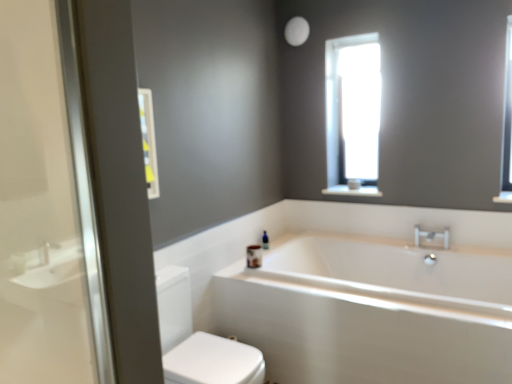
What do you see at coordinates (431, 238) in the screenshot? This screenshot has height=384, width=512. I see `silver metallic faucet at upper right` at bounding box center [431, 238].

The image size is (512, 384). What do you see at coordinates (265, 240) in the screenshot? I see `blue glass bottle at upper center` at bounding box center [265, 240].

Identify the location of white glossy toilet at lower left. The image size is (512, 384). (198, 340).

The height and width of the screenshot is (384, 512). I want to click on silver metallic faucet at upper right, so click(431, 238).

From the image's perspective, between blue glass bottle at upper center and white glossy toilet at lower left, which one is located above?

blue glass bottle at upper center.

Between blue glass bottle at upper center and white glossy toilet at lower left, which one is positioned behind?

blue glass bottle at upper center is more distant.

Which is closer, (263, 243) or (194, 345)?

Clearly, point (263, 243) is more distant from the camera than point (194, 345).

Considering the sizes of objects blue glass bottle at upper center and silver metallic faucet at upper right in the image provided, who is thinner, blue glass bottle at upper center or silver metallic faucet at upper right?

silver metallic faucet at upper right is thinner.

Considering the sizes of objects blue glass bottle at upper center and silver metallic faucet at upper right in the image provided, who is taller, blue glass bottle at upper center or silver metallic faucet at upper right?

With more height is blue glass bottle at upper center.

Considering the relative positions of blue glass bottle at upper center and silver metallic faucet at upper right in the image provided, is blue glass bottle at upper center in front of silver metallic faucet at upper right?

That is False.

From a real-world perspective, between blue glass bottle at upper center and white glossy medicine cabinet at upper left, who is vertically higher?

white glossy medicine cabinet at upper left is physically above.

From the image's perspective, is blue glass bottle at upper center above white glossy medicine cabinet at upper left?

Incorrect, from the image's perspective, blue glass bottle at upper center is lower than white glossy medicine cabinet at upper left.

Considering the positions of point (262, 238) and point (154, 183), is point (262, 238) closer or farther from the camera than point (154, 183)?

Point (262, 238) is farther from the camera than point (154, 183).

Between blue glass bottle at upper center and white glossy medicine cabinet at upper left, which one has more height?

white glossy medicine cabinet at upper left.

This screenshot has width=512, height=384. I want to click on bathtub lying below the white glossy medicine cabinet at upper left (from the image's perspective), so click(371, 311).

Between white glossy bathtub at center and white glossy medicine cabinet at upper left, which one is positioned in front?

Positioned in front is white glossy bathtub at center.

Considering the sizes of white glossy bathtub at center and white glossy medicine cabinet at upper left in the image, is white glossy bathtub at center taller or shorter than white glossy medicine cabinet at upper left?

In the image, white glossy bathtub at center appears to be taller than white glossy medicine cabinet at upper left.

What's the angular difference between white glossy bathtub at center and white glossy toilet at lower left's facing directions?

white glossy bathtub at center and white glossy toilet at lower left are facing 91 degrees away from each other.

Consider the image. Does white glossy bathtub at center turn towards white glossy toilet at lower left?

Yes, white glossy bathtub at center is turned towards white glossy toilet at lower left.

From the image's perspective, which one is positioned higher, white glossy bathtub at center or white glossy toilet at lower left?

white glossy bathtub at center.

How much distance is there between white glossy bathtub at center and white glossy toilet at lower left?

white glossy bathtub at center and white glossy toilet at lower left are 21.25 inches apart from each other.

This screenshot has width=512, height=384. I want to click on tap behind the white glossy toilet at lower left, so click(431, 238).

Which is more to the right, white glossy toilet at lower left or silver metallic faucet at upper right?

From the viewer's perspective, silver metallic faucet at upper right appears more on the right side.

Does white glossy toilet at lower left have a greater height compared to silver metallic faucet at upper right?

Correct, white glossy toilet at lower left is much taller as silver metallic faucet at upper right.

From the image's perspective, relative to white glossy bathtub at center, is blue glass bottle at upper center above or below?

From the image's perspective, blue glass bottle at upper center appears above white glossy bathtub at center.

Between blue glass bottle at upper center and white glossy bathtub at center, which one appears on the left side from the viewer's perspective?

Positioned to the left is blue glass bottle at upper center.

Is blue glass bottle at upper center bigger or smaller than white glossy bathtub at center?

Clearly, blue glass bottle at upper center is smaller in size than white glossy bathtub at center.

Measure the distance between blue glass bottle at upper center and white glossy bathtub at center.

They are 94.44 centimeters apart.

What are the coordinates of `toilet bowl that appears in front of the blue glass bottle at upper center` in the screenshot? It's located at (198, 340).

Find the location of `tap above the blue glass bottle at upper center (from a real-world perspective)`. tap above the blue glass bottle at upper center (from a real-world perspective) is located at coordinates (431, 238).

Estimate the real-world distances between objects in this image. Which object is closer to white glossy bathtub at center, blue glass bottle at upper center or white glossy medicine cabinet at upper left?

The object closer to white glossy bathtub at center is blue glass bottle at upper center.

From the image, which object appears to be nearer to blue glass bottle at upper center, white glossy toilet at lower left or silver metallic faucet at upper right?

white glossy toilet at lower left is positioned closer to the anchor blue glass bottle at upper center.

When comparing their distances from white glossy medicine cabinet at upper left, does white glossy toilet at lower left or blue glass bottle at upper center seem closer?

The object closer to white glossy medicine cabinet at upper left is white glossy toilet at lower left.

Based on the photo, which object lies further to the anchor point white glossy toilet at lower left, blue glass bottle at upper center or white glossy medicine cabinet at upper left?

Based on the image, blue glass bottle at upper center appears to be further to white glossy toilet at lower left.

From the image, which object appears to be farther from white glossy toilet at lower left, blue glass bottle at upper center or white glossy bathtub at center?

Among the two, blue glass bottle at upper center is located further to white glossy toilet at lower left.

Considering their positions, is white glossy medicine cabinet at upper left positioned closer to silver metallic faucet at upper right than blue glass bottle at upper center?

Based on the image, blue glass bottle at upper center appears to be nearer to silver metallic faucet at upper right.

Looking at this image, from the image, which object appears to be farther from white glossy medicine cabinet at upper left, white glossy bathtub at center or white glossy toilet at lower left?

white glossy bathtub at center is positioned further to the anchor white glossy medicine cabinet at upper left.

Looking at the image, which one is located closer to blue glass bottle at upper center, silver metallic faucet at upper right or white glossy medicine cabinet at upper left?

silver metallic faucet at upper right lies closer to blue glass bottle at upper center than the other object.

Where is `tap located between white glossy bathtub at center and blue glass bottle at upper center in the depth direction`? tap located between white glossy bathtub at center and blue glass bottle at upper center in the depth direction is located at coordinates (431, 238).

The width and height of the screenshot is (512, 384). I want to click on medicine cabinet between white glossy toilet at lower left and blue glass bottle at upper center in the front-back direction, so click(148, 142).

The width and height of the screenshot is (512, 384). I want to click on bathtub situated between white glossy toilet at lower left and silver metallic faucet at upper right from left to right, so click(371, 311).

You are a GUI agent. You are given a task and a screenshot of the screen. Output one action in this format:
    pyautogui.click(x=<x>, y=<y>)
    Task: Click on the toiletry located between white glossy toilet at lower left and silver metallic faucet at upper right in the left-right direction
    
    Given the screenshot: What is the action you would take?
    pyautogui.click(x=265, y=240)